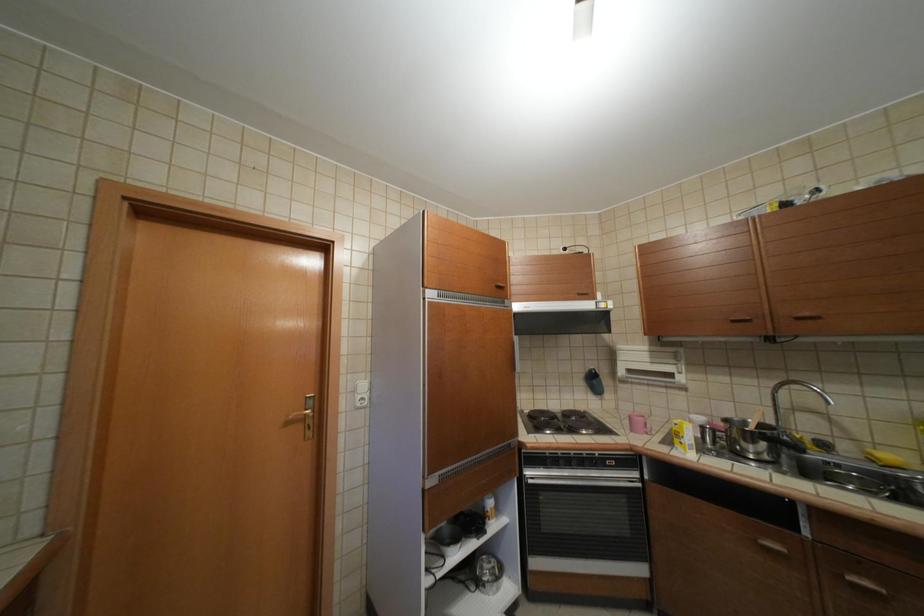
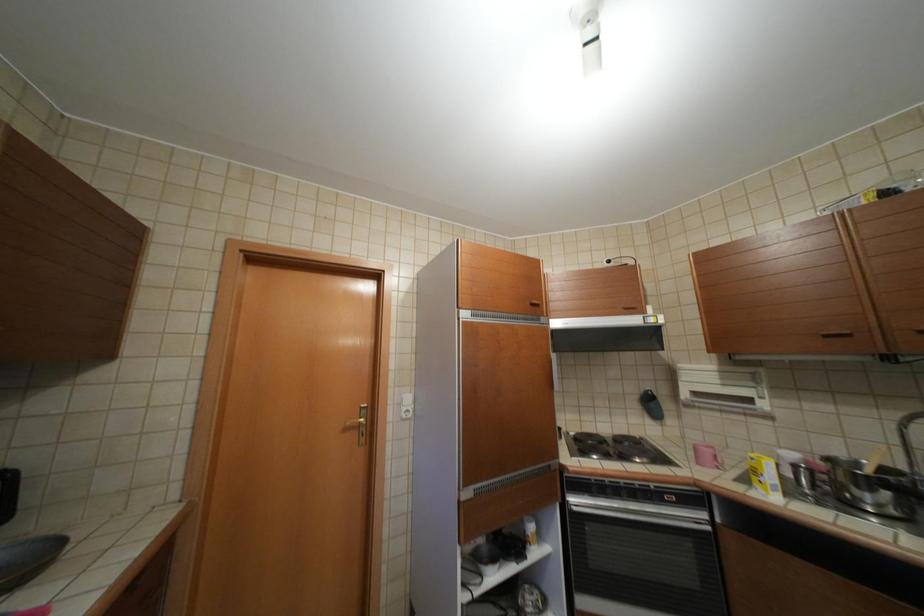
Question: The first image is from the beginning of the video and the second image is from the end. How did the camera likely rotate when shooting the video?

Choices:
 (A) Left
 (B) Right
 (C) Up
 (D) Down

Answer: (A)